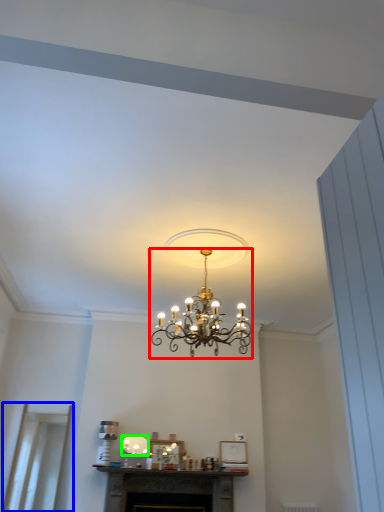
Question: Based on their relative distances, which object is farther from lamp (highlighted by a red box)? Choose from glass door (highlighted by a blue box) and lamp (highlighted by a green box).

Choices:
 (A) glass door
 (B) lamp

Answer: (A)